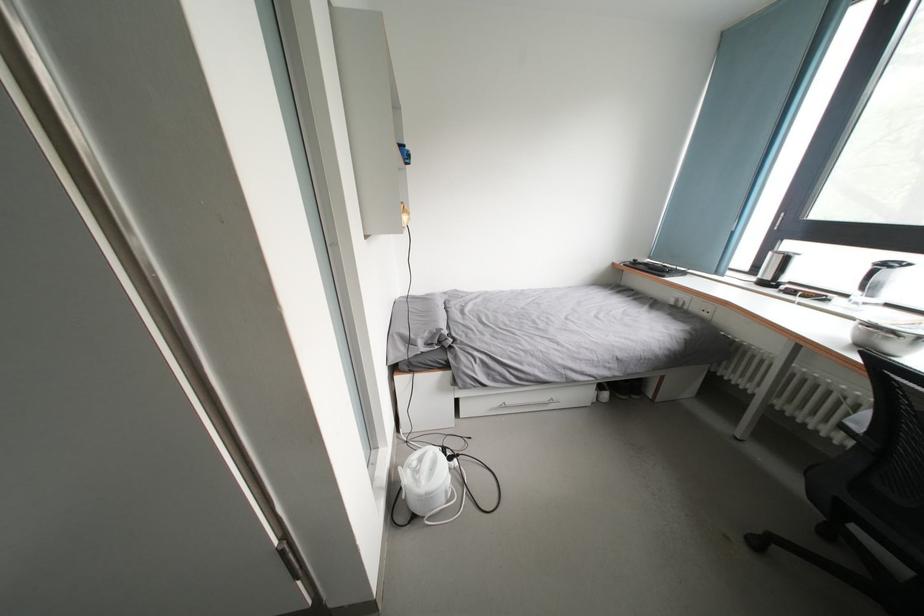
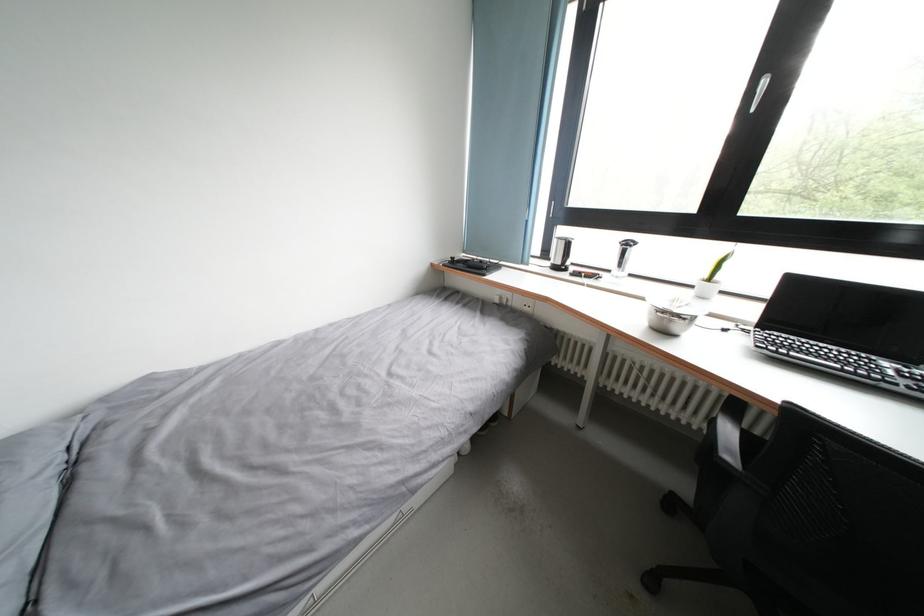
Question: The camera is either moving clockwise (left) or counter-clockwise (right) around the object. The first image is from the beginning of the video and the second image is from the end. Is the camera moving left or right when shooting the video?

Choices:
 (A) Left
 (B) Right

Answer: (A)